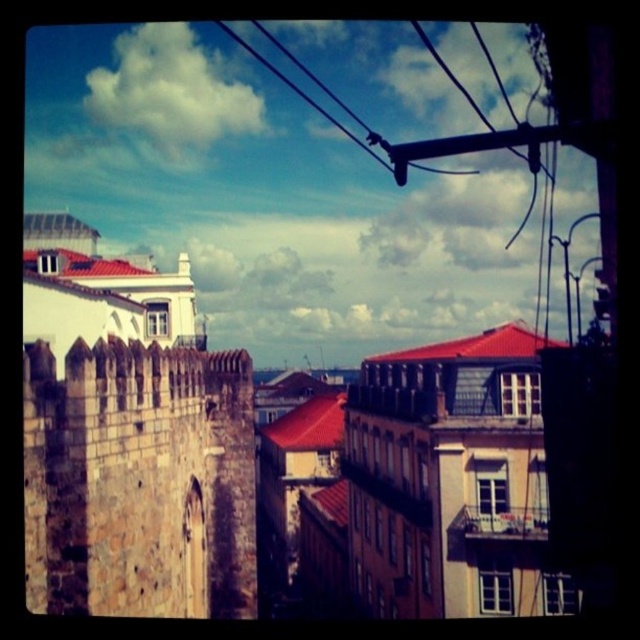
Which is more to the left, brown stone wall at left or black wire at upper center?

black wire at upper center

Between brown stone wall at left and black wire at upper center, which one appears on the right side from the viewer's perspective?

Positioned to the right is brown stone wall at left.

Image resolution: width=640 pixels, height=640 pixels. What are the coordinates of `brown stone wall at left` in the screenshot? It's located at (140, 481).

Locate an element on the screen. This screenshot has height=640, width=640. brown stone wall at left is located at coordinates (140, 481).